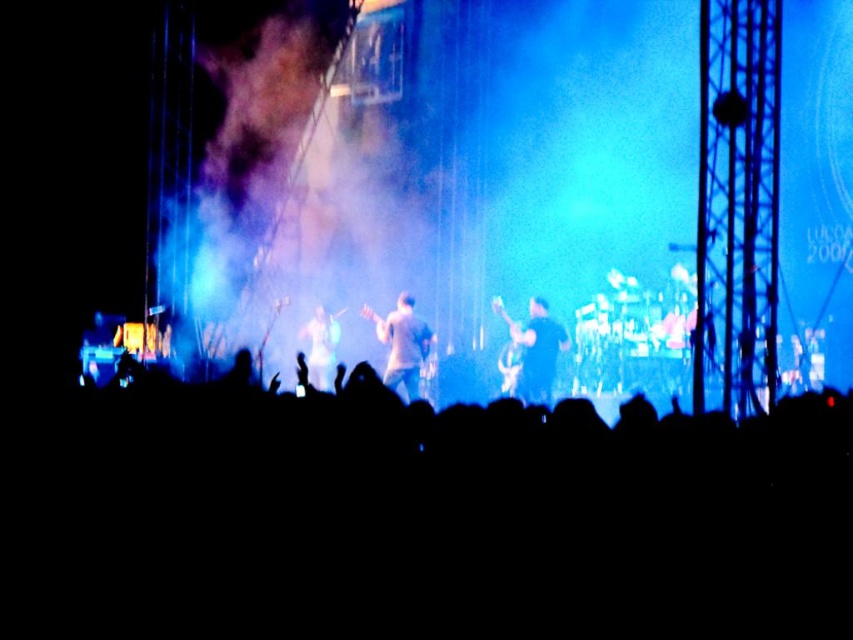
You are a photographer at the concert. You want to capture a photo where the light brown fabric shirt at center is clearly visible without being obscured by the smoke at center. Based on their sizes, is this possible?

The smoke at center is larger in size than light brown fabric shirt at center, so it might be challenging to capture the light brown fabric shirt at center without some obscuration from the smoke at center.

You are a photographer at the concert. You want to capture a photo where the light brown fabric shirt at center is clearly visible without being blocked by the shiny silver guitar at center. Based on the scene description, can you position yourself in a way to achieve this?

The light brown fabric shirt at center is in front of the shiny silver guitar at center, so you can position yourself behind the light brown fabric shirt at center to ensure it is not blocked by the guitar.